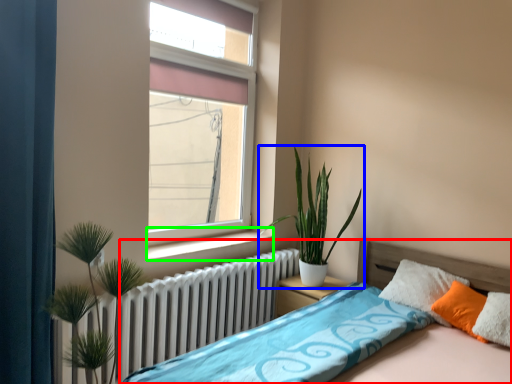
Question: Which is farther away from bed (highlighted by a red box)? houseplant (highlighted by a blue box) or window sill (highlighted by a green box)?

Choices:
 (A) houseplant
 (B) window sill

Answer: (B)